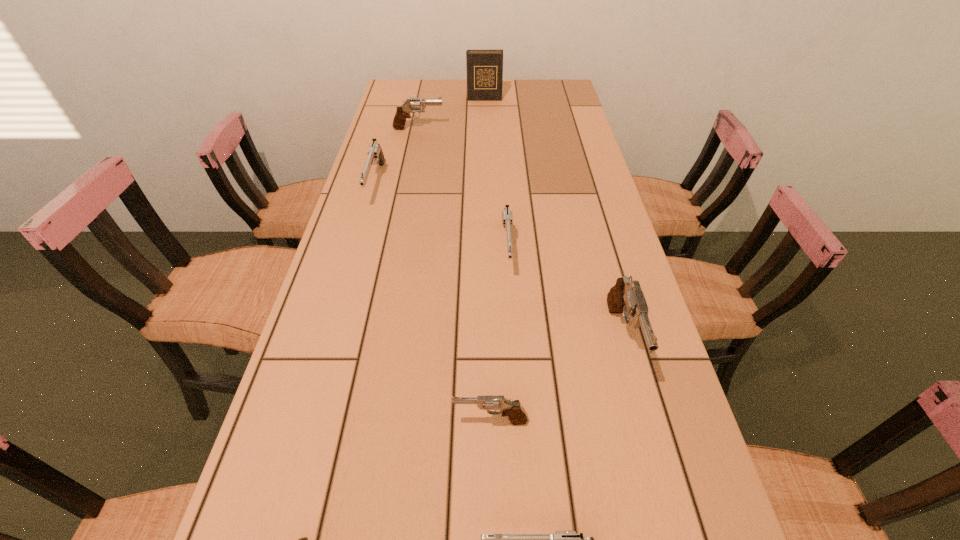
Locate an element on the screen. The image size is (960, 540). object that is at the far edge is located at coordinates (484, 68).

Locate an element on the screen. This screenshot has width=960, height=540. object that is at the right edge is located at coordinates (626, 297).

Image resolution: width=960 pixels, height=540 pixels. In the image, there is a desktop. Find the location of `vacant space at the far edge`. vacant space at the far edge is located at coordinates (433, 92).

Find the location of a particular element. The width and height of the screenshot is (960, 540). vacant area at the left edge of the desktop is located at coordinates (379, 178).

The height and width of the screenshot is (540, 960). What are the coordinates of `free space at the right edge of the desktop` in the screenshot? It's located at (559, 134).

This screenshot has height=540, width=960. Identify the location of vacant area at the far left corner. (406, 94).

Locate an element on the screen. This screenshot has height=540, width=960. free location at the far right corner is located at coordinates (568, 104).

Find the location of a particular element. Image resolution: width=960 pixels, height=540 pixels. vacant region between the diary and the tallest pistol is located at coordinates (554, 218).

I want to click on free space between the farthest silver pistol and the rightmost pistol, so click(499, 261).

You are a GUI agent. You are given a task and a screenshot of the screen. Output one action in this format:
    pyautogui.click(x=<x>, y=<y>)
    Task: Click on the vacant space that's between the smallest gray pistol and the sixth nearest pistol
    
    Given the screenshot: What is the action you would take?
    433,302